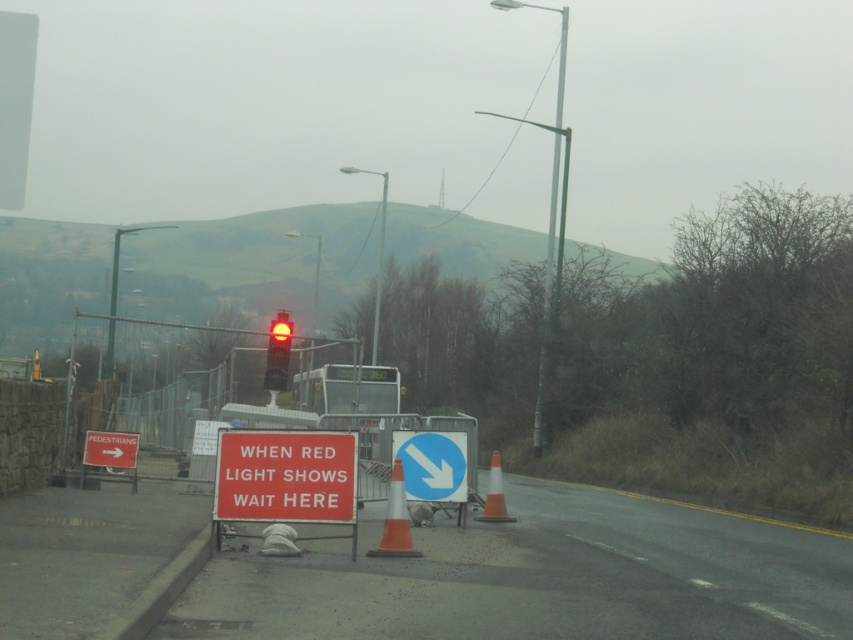
Question: Which of these objects is positioned closest to the white plastic sign at left?

Choices:
 (A) green metallic pole at right
 (B) red matte sign at center

Answer: (B)

Question: Which point is closer to the camera taking this photo?

Choices:
 (A) pyautogui.click(x=280, y=502)
 (B) pyautogui.click(x=453, y=458)

Answer: (A)

Question: Is red matte sign at center behind green metallic pole at right?

Choices:
 (A) yes
 (B) no

Answer: (B)

Question: Does green metallic pole at right come behind orange reflective cone at center?

Choices:
 (A) no
 (B) yes

Answer: (B)

Question: Among these points, which one is nearest to the camera?

Choices:
 (A) (276, 317)
 (B) (404, 508)

Answer: (B)

Question: In this image, where is red glass traffic light at center located relative to orange reflective cone at center?

Choices:
 (A) left
 (B) right

Answer: (A)